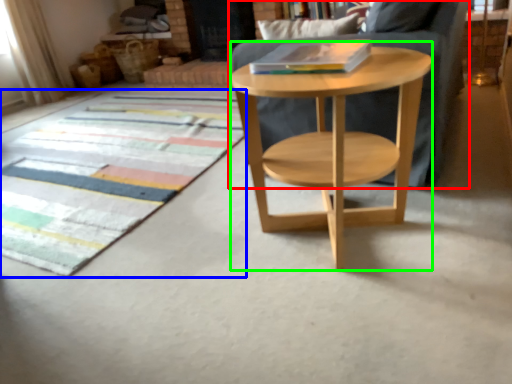
Question: Which object is positioned closest to chair (highlighted by a red box)? Select from mat (highlighted by a blue box) and round table (highlighted by a green box).

Choices:
 (A) mat
 (B) round table

Answer: (B)